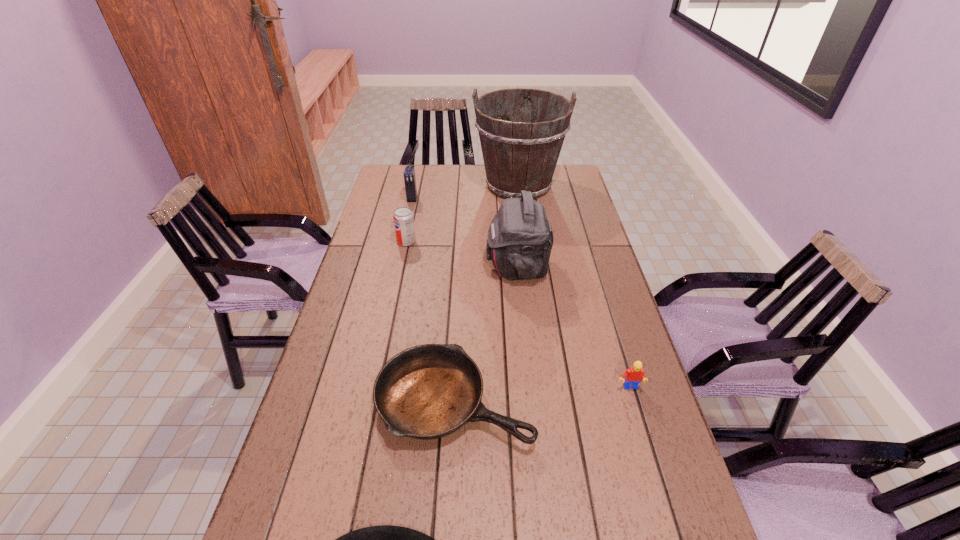
What are the coordinates of `free point between the Lego and the bucket` in the screenshot? It's located at (574, 287).

Identify which object is the sixth nearest to the shortest object. Please provide its 2D coordinates. Your answer should be formatted as a tuple, i.e. [(x, y)], where the tuple contains the x and y coordinates of a point satisfying the conditions above.

[(409, 173)]

The image size is (960, 540). I want to click on object that is the fifth closest to the soda, so [x=634, y=375].